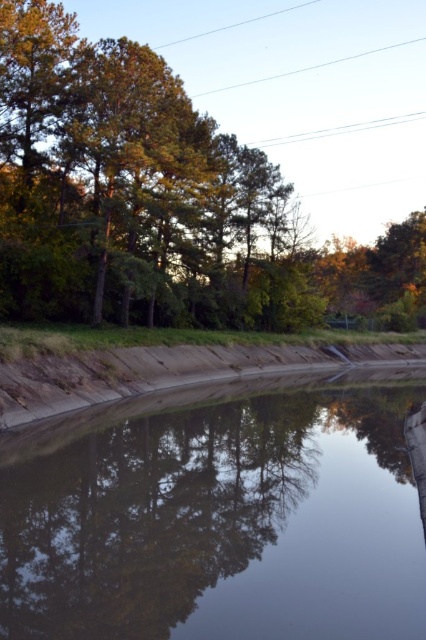
Is point (317, 588) behind point (419, 268)?

No, (317, 588) is in front of (419, 268).

Consider the image. Can you confirm if smooth reflective water at center is positioned to the left of green leafy tree at upper left?

Correct, you'll find smooth reflective water at center to the left of green leafy tree at upper left.

Between point (311, 456) and point (302, 304), which one is positioned in front?

Point (311, 456) is more forward.

Locate an element on the screen. The image size is (426, 640). smooth reflective water at center is located at coordinates (218, 515).